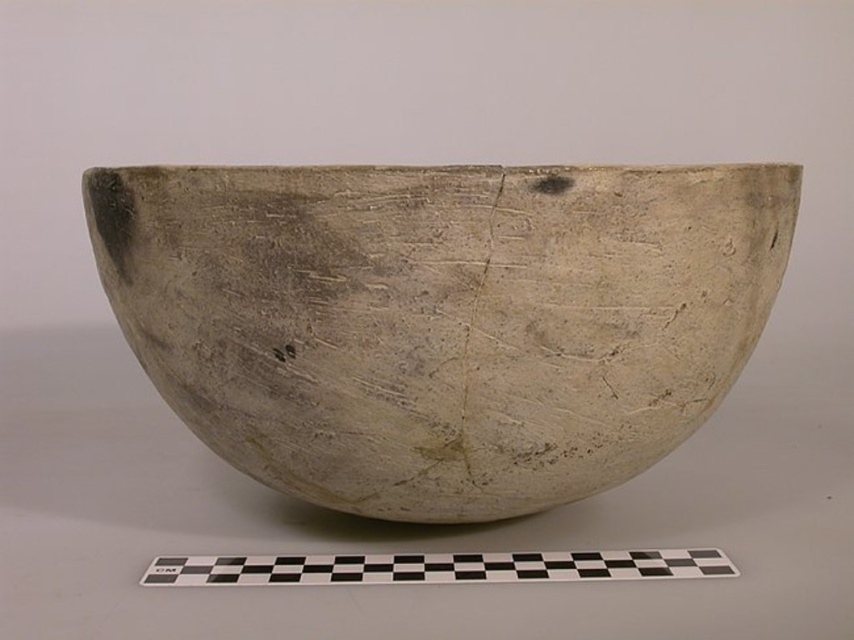
Which is more to the left, matte clay bowl at center or black/white checkered strip at lower center?

From the viewer's perspective, matte clay bowl at center appears more on the left side.

Between matte clay bowl at center and black/white checkered strip at lower center, which one is positioned lower?

black/white checkered strip at lower center is lower down.

Between point (120, 204) and point (651, 577), which one is positioned behind?

Positioned behind is point (651, 577).

The image size is (854, 640). In order to click on matte clay bowl at center in this screenshot , I will do `click(442, 320)`.